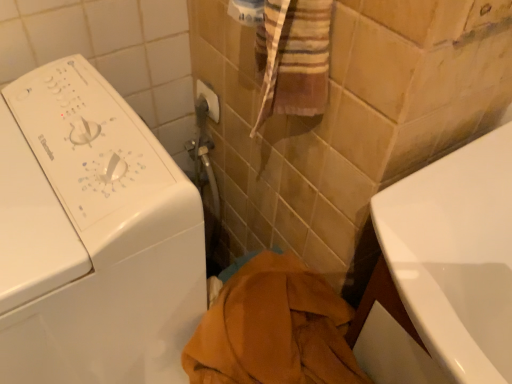
Question: Considering the relative sizes of white glossy washing machine at left and white plastic towel bar at upper center in the image provided, is white glossy washing machine at left shorter than white plastic towel bar at upper center?

Choices:
 (A) yes
 (B) no

Answer: (B)

Question: From the image's perspective, is white glossy washing machine at left beneath white plastic towel bar at upper center?

Choices:
 (A) no
 (B) yes

Answer: (B)

Question: Does white glossy washing machine at left have a smaller size compared to white plastic towel bar at upper center?

Choices:
 (A) yes
 (B) no

Answer: (B)

Question: Considering the relative sizes of white glossy washing machine at left and white plastic towel bar at upper center in the image provided, is white glossy washing machine at left bigger than white plastic towel bar at upper center?

Choices:
 (A) yes
 (B) no

Answer: (A)

Question: Could you tell me if white glossy washing machine at left is turned towards white plastic towel bar at upper center?

Choices:
 (A) yes
 (B) no

Answer: (B)

Question: Is white plastic towel bar at upper center taller or shorter than white glossy bathtub at lower right?

Choices:
 (A) short
 (B) tall

Answer: (A)

Question: Is white plastic towel bar at upper center wider or thinner than white glossy bathtub at lower right?

Choices:
 (A) thin
 (B) wide

Answer: (A)

Question: From a real-world perspective, relative to white glossy bathtub at lower right, is white plastic towel bar at upper center vertically above or below?

Choices:
 (A) below
 (B) above

Answer: (B)

Question: Considering the positions of white plastic towel bar at upper center and white glossy bathtub at lower right in the image, is white plastic towel bar at upper center bigger or smaller than white glossy bathtub at lower right?

Choices:
 (A) big
 (B) small

Answer: (B)

Question: From the image's perspective, is white glossy bathtub at lower right above or below white plastic towel bar at upper center?

Choices:
 (A) below
 (B) above

Answer: (A)

Question: In terms of size, does white glossy bathtub at lower right appear bigger or smaller than white plastic towel bar at upper center?

Choices:
 (A) small
 (B) big

Answer: (B)

Question: From their relative heights in the image, would you say white glossy bathtub at lower right is taller or shorter than white plastic towel bar at upper center?

Choices:
 (A) tall
 (B) short

Answer: (A)

Question: Is white glossy bathtub at lower right in front of or behind white plastic towel bar at upper center in the image?

Choices:
 (A) behind
 (B) front

Answer: (B)

Question: From the image's perspective, relative to white glossy washing machine at left, is white glossy bathtub at lower right above or below?

Choices:
 (A) above
 (B) below

Answer: (B)

Question: Does point (473, 256) appear closer or farther from the camera than point (56, 380)?

Choices:
 (A) farther
 (B) closer

Answer: (B)